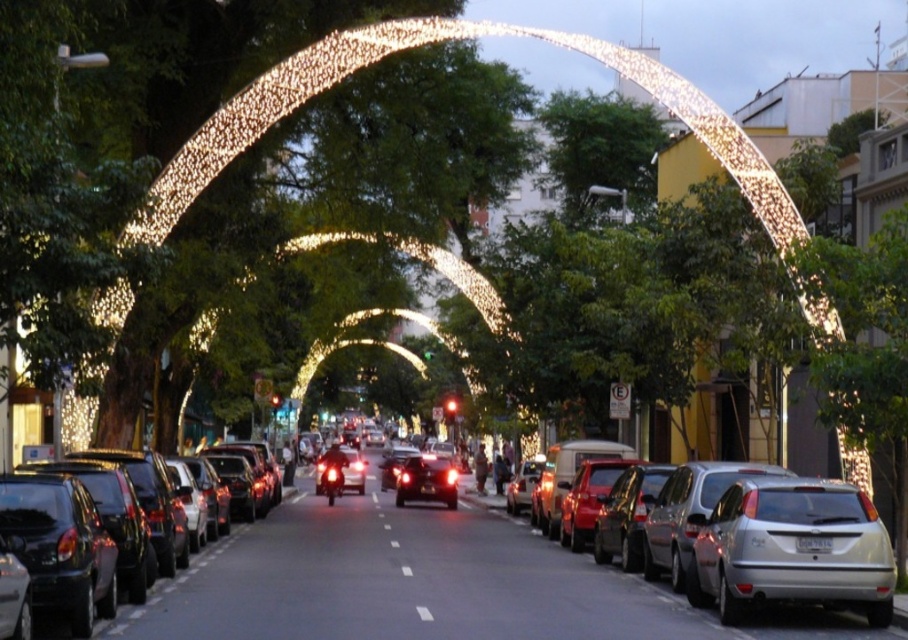
Does illuminated fabric arch at center appear on the left side of silver metallic sedan at center-right?

No, illuminated fabric arch at center is not to the left of silver metallic sedan at center-right.

Who is positioned more to the left, illuminated fabric arch at center or silver metallic sedan at center-right?

silver metallic sedan at center-right

Between point (306, 81) and point (768, 499), which one is positioned in front?

Positioned in front is point (768, 499).

The width and height of the screenshot is (908, 640). What are the coordinates of `illuminated fabric arch at center` in the screenshot? It's located at (423, 44).

Based on the photo, can you confirm if illuminated fabric arch at center is positioned to the right of matte black car at center?

Yes, illuminated fabric arch at center is to the right of matte black car at center.

Is point (701, 115) closer to viewer compared to point (46, 628)?

No, it is behind (46, 628).

Between point (150, 198) and point (245, 520), which one is positioned behind?

Point (245, 520)

Where is `illuminated fabric arch at center`? The height and width of the screenshot is (640, 908). illuminated fabric arch at center is located at coordinates (423, 44).

Does point (186, 564) lie in front of point (407, 568)?

No, it is not.

Can you confirm if matte black car at center is wider than white dotted line at center?

Incorrect, matte black car at center's width does not surpass white dotted line at center's.

Who is more forward, (232, 531) or (378, 513)?

Positioned in front is point (232, 531).

Locate an element on the screen. Image resolution: width=908 pixels, height=640 pixels. matte black car at center is located at coordinates (196, 561).